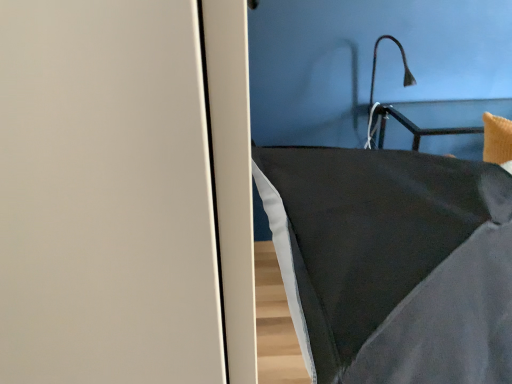
This screenshot has width=512, height=384. What do you see at coordinates (393, 263) in the screenshot?
I see `dark gray fabric pillow at center` at bounding box center [393, 263].

What is the approximate width of dark gray fabric pillow at center?

dark gray fabric pillow at center is 32.40 inches in width.

Find the location of a particular element. The image size is (512, 384). dark gray fabric pillow at center is located at coordinates (393, 263).

Describe the element at coordinates (403, 64) in the screenshot. I see `black matte lamp at upper right` at that location.

Measure the distance between black matte lamp at upper right and camera.

black matte lamp at upper right and camera are 1.70 meters apart from each other.

Where is `black matte lamp at upper right`? The height and width of the screenshot is (384, 512). black matte lamp at upper right is located at coordinates (403, 64).

Identify the location of dark gray fabric pillow at center. This screenshot has height=384, width=512. (393, 263).

Considering the relative positions of dark gray fabric pillow at center and black matte lamp at upper right in the image provided, is dark gray fabric pillow at center to the left or to the right of black matte lamp at upper right?

In the image, dark gray fabric pillow at center appears on the left side of black matte lamp at upper right.

Between dark gray fabric pillow at center and black matte lamp at upper right, which one is positioned behind?

black matte lamp at upper right is more distant.

Is point (373, 295) positioned in front of point (404, 86)?

Yes, point (373, 295) is in front of point (404, 86).

From the image's perspective, between dark gray fabric pillow at center and black matte lamp at upper right, which one is located above?

black matte lamp at upper right appears higher in the image.

Consider the image. From a real-world perspective, is dark gray fabric pillow at center positioned under black matte lamp at upper right based on gravity?

Indeed, from a real-world perspective, dark gray fabric pillow at center is positioned beneath black matte lamp at upper right.

Based on the photo, does dark gray fabric pillow at center have a lesser width compared to black matte lamp at upper right?

No.

Considering the relative sizes of dark gray fabric pillow at center and black matte lamp at upper right in the image provided, is dark gray fabric pillow at center taller than black matte lamp at upper right?

Indeed, dark gray fabric pillow at center has a greater height compared to black matte lamp at upper right.

Which of these two, dark gray fabric pillow at center or black matte lamp at upper right, is smaller?

With smaller size is black matte lamp at upper right.

Do you think dark gray fabric pillow at center is within black matte lamp at upper right, or outside of it?

dark gray fabric pillow at center is located beyond the bounds of black matte lamp at upper right.

Are dark gray fabric pillow at center and black matte lamp at upper right beside each other?

dark gray fabric pillow at center and black matte lamp at upper right are clearly separated.

Is dark gray fabric pillow at center facing away from black matte lamp at upper right?

No, dark gray fabric pillow at center is not facing away from black matte lamp at upper right.

The image size is (512, 384). I want to click on light fixture on the right of dark gray fabric pillow at center, so click(403, 64).

From the picture: In the image, is black matte lamp at upper right on the left side or the right side of dark gray fabric pillow at center?

black matte lamp at upper right is to the right of dark gray fabric pillow at center.

Does black matte lamp at upper right come behind dark gray fabric pillow at center?

Yes.

Which is less distant, (373, 66) or (357, 212)?

Clearly, point (373, 66) is more distant from the camera than point (357, 212).

Based on the photo, from the image's perspective, is black matte lamp at upper right on dark gray fabric pillow at center?

Yes, from the image's perspective, black matte lamp at upper right is above dark gray fabric pillow at center.

From a real-world perspective, who is located higher, black matte lamp at upper right or dark gray fabric pillow at center?

From a 3D spatial view, black matte lamp at upper right is above.

Between black matte lamp at upper right and dark gray fabric pillow at center, which one has larger width?

With larger width is dark gray fabric pillow at center.

In terms of height, does black matte lamp at upper right look taller or shorter compared to dark gray fabric pillow at center?

black matte lamp at upper right is shorter than dark gray fabric pillow at center.

Who is bigger, black matte lamp at upper right or dark gray fabric pillow at center?

Bigger between the two is dark gray fabric pillow at center.

Is black matte lamp at upper right situated inside dark gray fabric pillow at center or outside?

black matte lamp at upper right is not inside dark gray fabric pillow at center, it's outside.

Is black matte lamp at upper right touching dark gray fabric pillow at center?

black matte lamp at upper right and dark gray fabric pillow at center are not in contact.

Looking at this image, does black matte lamp at upper right turn towards dark gray fabric pillow at center?

No, black matte lamp at upper right is not facing towards dark gray fabric pillow at center.

You are a GUI agent. You are given a task and a screenshot of the screen. Output one action in this format:
    pyautogui.click(x=<x>, y=<y>)
    Task: Click on the furniture in front of the black matte lamp at upper right
    This screenshot has width=512, height=384.
    Given the screenshot: What is the action you would take?
    pyautogui.click(x=393, y=263)

Where is `light fixture above the dark gray fabric pillow at center (from the image's perspective)`? light fixture above the dark gray fabric pillow at center (from the image's perspective) is located at coordinates (403, 64).

Identify the location of furniture below the black matte lamp at upper right (from the image's perspective). (393, 263).